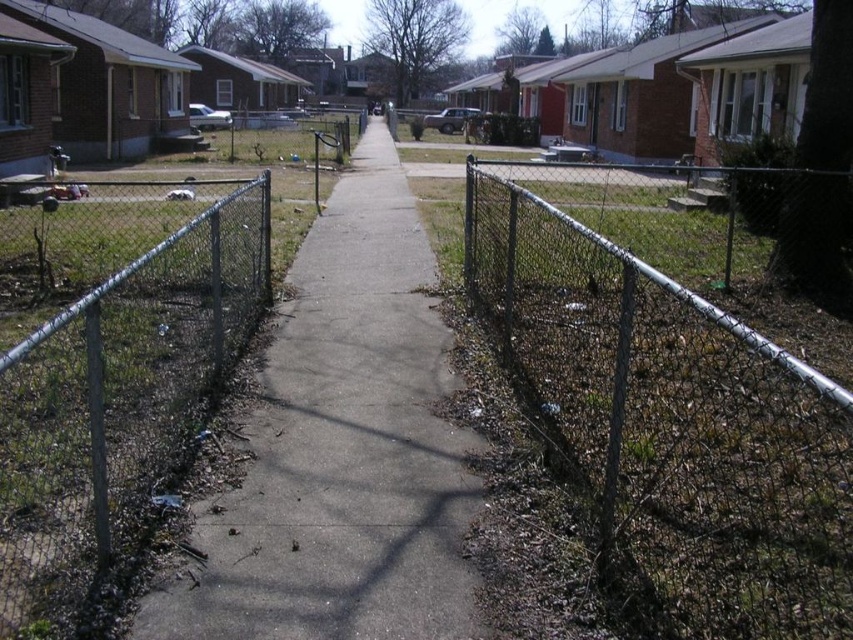
Looking at this image, you are standing on the sidewalk in the residential neighborhood scene. You see two points marked on the image, one at coordinates point (x=814, y=440) and another at point (x=6, y=614). Which point is closer to you?

Point (x=6, y=614) is closer to you because it is nearer to the camera compared to point (x=814, y=440), which is further away.